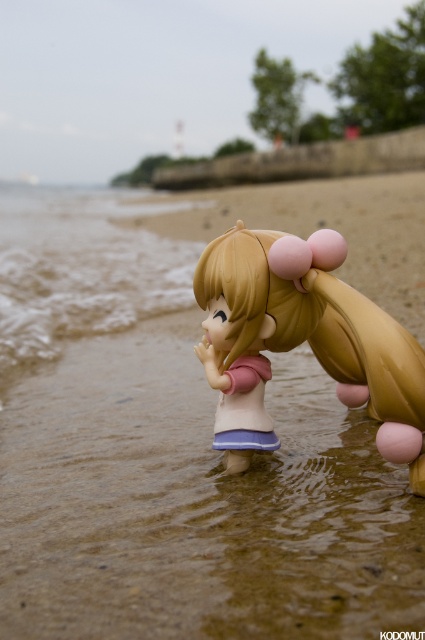
What do you see at coordinates (195, 504) in the screenshot?
I see `sandy brown beach at center` at bounding box center [195, 504].

Can you confirm if sandy brown beach at center is bigger than satin gold hair at center?

Indeed, sandy brown beach at center has a larger size compared to satin gold hair at center.

The height and width of the screenshot is (640, 425). I want to click on sandy brown beach at center, so click(x=195, y=504).

What do you see at coordinates (195, 504) in the screenshot? I see `sandy brown beach at center` at bounding box center [195, 504].

Can you confirm if sandy brown beach at center is wider than clear water at lower left?

Yes.

Where is `sandy brown beach at center`? This screenshot has width=425, height=640. sandy brown beach at center is located at coordinates (195, 504).

Is satin gold hair at center wider than clear water at lower left?

No, satin gold hair at center is not wider than clear water at lower left.

Is satin gold hair at center to the right of clear water at lower left from the viewer's perspective?

Correct, you'll find satin gold hair at center to the right of clear water at lower left.

Is point (215, 339) closer to viewer compared to point (91, 257)?

Yes, it is in front of point (91, 257).

You are a GUI agent. You are given a task and a screenshot of the screen. Output one action in this format:
    pyautogui.click(x=<x>, y=<y>)
    Task: Click on the satin gold hair at center
    
    Given the screenshot: What is the action you would take?
    pyautogui.click(x=311, y=328)